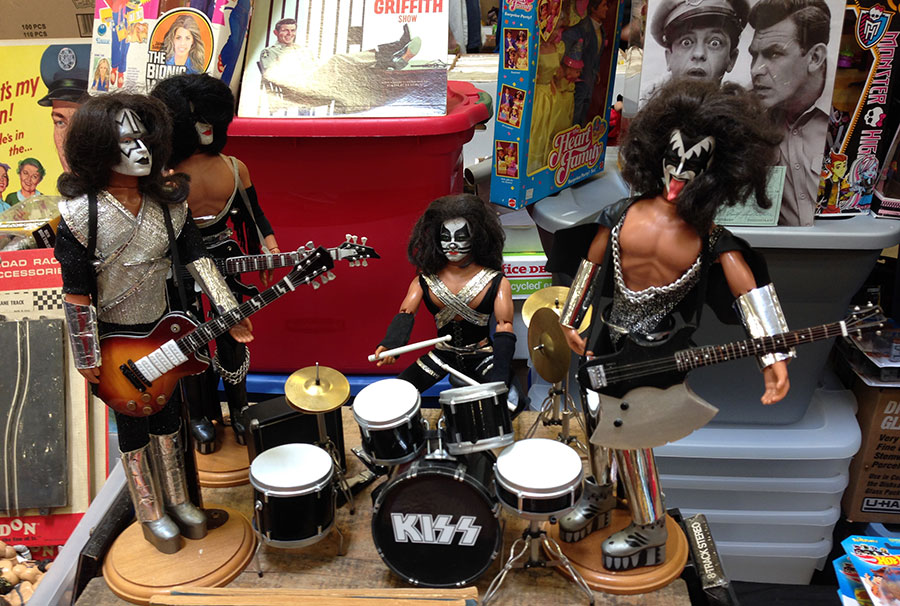
Locate an element on the screen. This screenshot has width=900, height=606. chest is located at coordinates (652, 265).